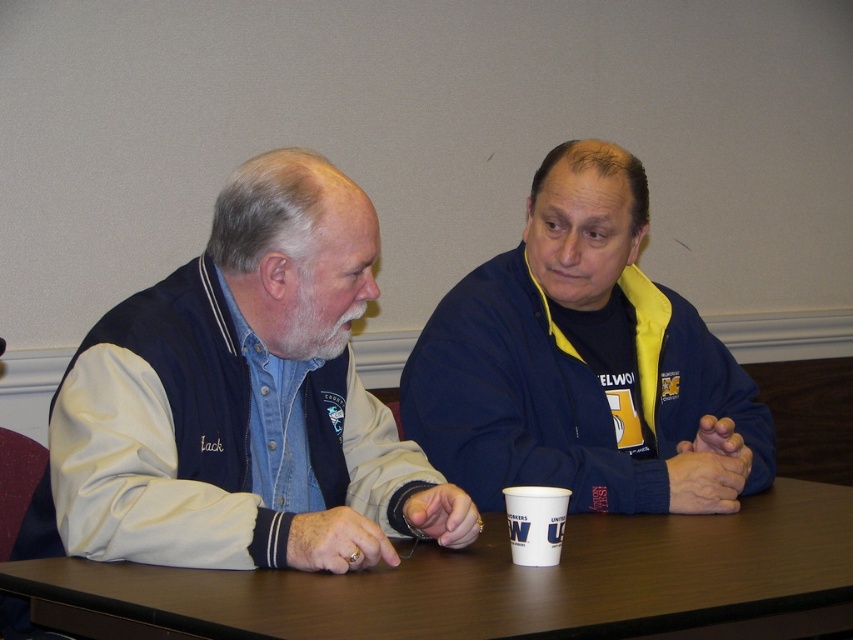
Is denim jacket at left shorter than navy blue jacket at center?

Yes, denim jacket at left is shorter than navy blue jacket at center.

Does point (233, 564) come in front of point (642, 465)?

Yes, it is in front of point (642, 465).

Find the location of a particular element. denim jacket at left is located at coordinates (245, 400).

Can you confirm if brown wooden table at center is positioned below white paper cup at center?

Indeed, brown wooden table at center is positioned under white paper cup at center.

What do you see at coordinates (500, 584) in the screenshot? The width and height of the screenshot is (853, 640). I see `brown wooden table at center` at bounding box center [500, 584].

Identify the location of brown wooden table at center. (500, 584).

Is denim jacket at left above brown wooden table at center?

Correct, denim jacket at left is located above brown wooden table at center.

Between denim jacket at left and brown wooden table at center, which one appears on the left side from the viewer's perspective?

denim jacket at left is more to the left.

Identify the location of denim jacket at left. The width and height of the screenshot is (853, 640). (245, 400).